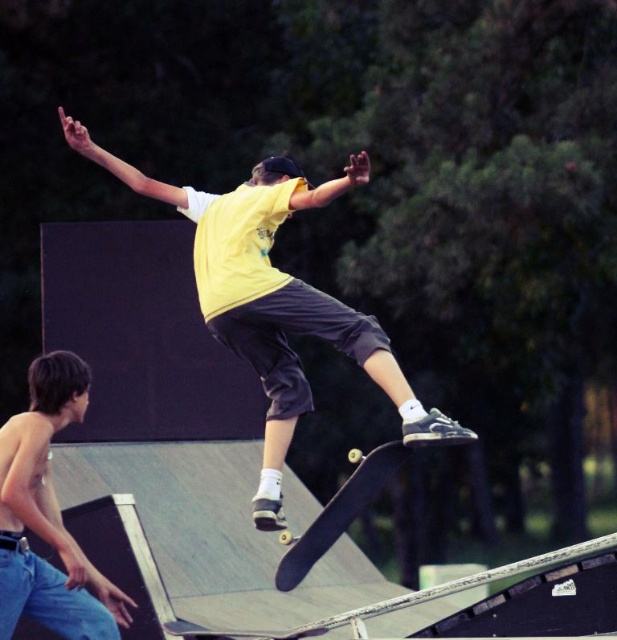
Question: Which point appears farthest from the camera in this image?

Choices:
 (A) (31, 400)
 (B) (318, 513)
 (C) (366, 324)

Answer: (B)

Question: Does shiny blue jeans at lower left appear over black smooth skateboard at center?

Choices:
 (A) yes
 (B) no

Answer: (A)

Question: Is yellow matte shirt at center bigger than black smooth skateboard at center?

Choices:
 (A) no
 (B) yes

Answer: (A)

Question: Among these objects, which one is farthest from the camera?

Choices:
 (A) shiny blue jeans at lower left
 (B) yellow matte shirt at center

Answer: (B)

Question: Which point is closer to the camera?

Choices:
 (A) (35, 573)
 (B) (196, 282)

Answer: (A)

Question: From the image, what is the correct spatial relationship of shiny blue jeans at lower left in relation to black smooth skateboard at center?

Choices:
 (A) above
 (B) below

Answer: (A)